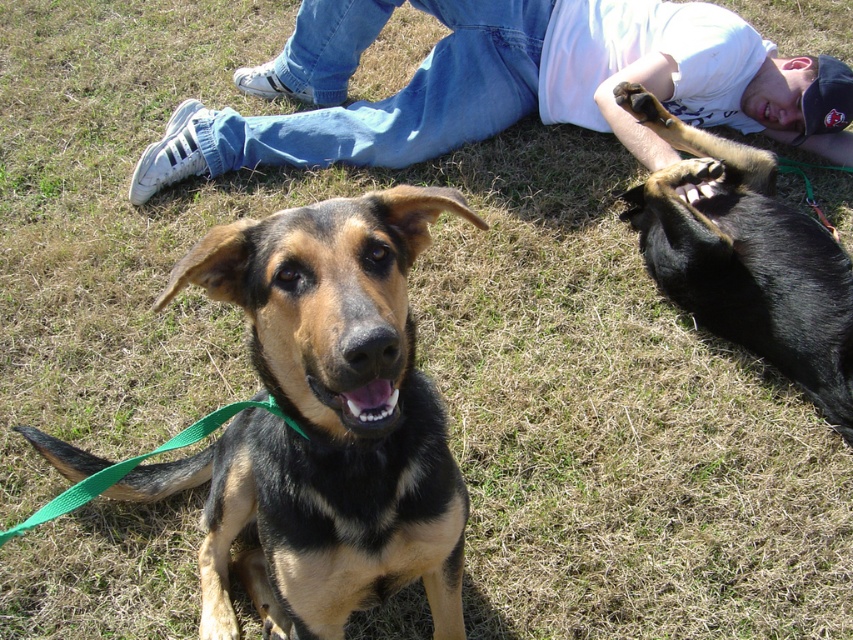
Is point (367, 195) less distant than point (184, 177)?

Yes, point (367, 195) is closer to viewer.

Does point (252, 467) lie in front of point (450, 83)?

Yes, point (252, 467) is closer to viewer.

This screenshot has height=640, width=853. Find the location of `black and tan fur dog at center`. black and tan fur dog at center is located at coordinates (323, 422).

Who is taller, jeans at center or black glossy dog at upper right?

With more height is black glossy dog at upper right.

Which is behind, point (309, 84) or point (699, 253)?

Positioned behind is point (309, 84).

Image resolution: width=853 pixels, height=640 pixels. What are the coordinates of `jeans at center` in the screenshot? It's located at (502, 84).

You are a GUI agent. You are given a task and a screenshot of the screen. Output one action in this format:
    pyautogui.click(x=<x>, y=<y>)
    Task: Click on the jeans at center
    The width and height of the screenshot is (853, 640).
    Given the screenshot: What is the action you would take?
    pyautogui.click(x=502, y=84)

Is black and tan fur dog at center bigger than black glossy dog at upper right?

Yes, black and tan fur dog at center is bigger than black glossy dog at upper right.

Does black and tan fur dog at center appear under black glossy dog at upper right?

Yes.

Where is `black and tan fur dog at center`? Image resolution: width=853 pixels, height=640 pixels. black and tan fur dog at center is located at coordinates (323, 422).